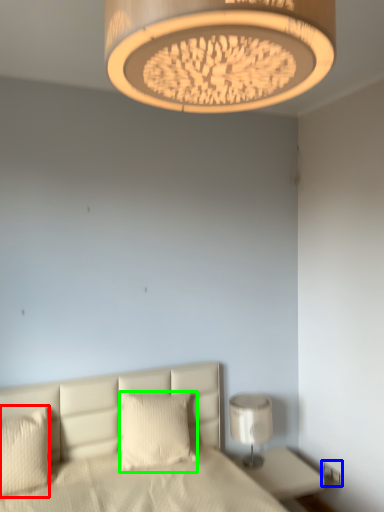
Question: Based on their relative distances, which object is farther from pillow (highlighted by a red box)? Choose from electric outlet (highlighted by a blue box) and pillow (highlighted by a green box).

Choices:
 (A) electric outlet
 (B) pillow

Answer: (A)